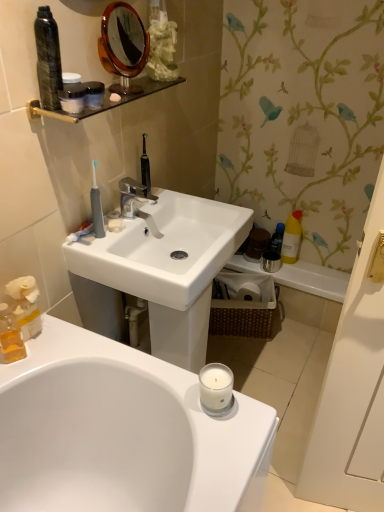
You are a GUI agent. You are given a task and a screenshot of the screen. Output one action in this format:
    pyautogui.click(x=<x>, y=<y>)
    Task: Click on the vacant space in front of blue plastic bottle at right, which is counted as the 4th mouthwash, starting from the top
    This screenshot has width=384, height=512.
    Given the screenshot: What is the action you would take?
    pyautogui.click(x=301, y=273)